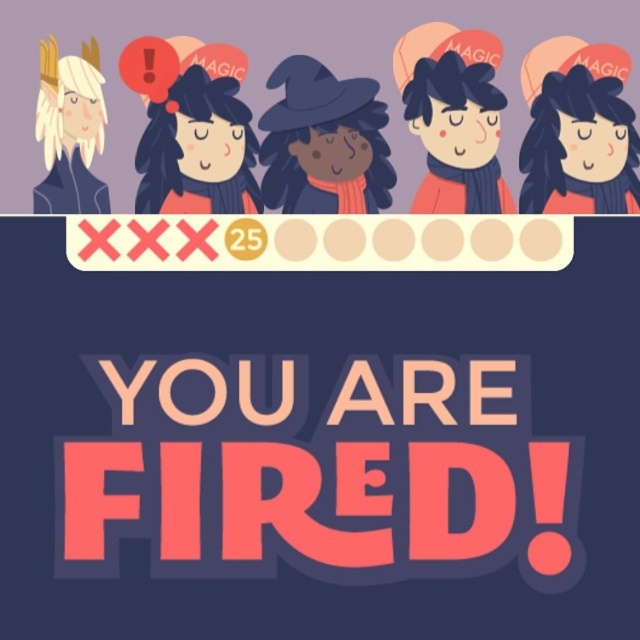
Question: Can you confirm if matte witch hat at center is positioned above smooth white hair at upper left?

Choices:
 (A) yes
 (B) no

Answer: (B)

Question: Which object appears closest to the camera in this image?

Choices:
 (A) matte black hair at center
 (B) matte witch hat at center

Answer: (A)

Question: Which object is farther from the camera taking this photo?

Choices:
 (A) matte black figure at left
 (B) matte witch hat at center
 (C) bold pink text at center
 (D) matte red hair at center

Answer: (B)

Question: Is matte witch hat at center smaller than matte red hair at center?

Choices:
 (A) no
 (B) yes

Answer: (B)

Question: Is matte witch hat at center smaller than smooth white hair at upper left?

Choices:
 (A) yes
 (B) no

Answer: (B)

Question: Which of the following is the farthest from the observer?

Choices:
 (A) (44, 118)
 (B) (232, 97)
 (C) (460, 518)

Answer: (B)